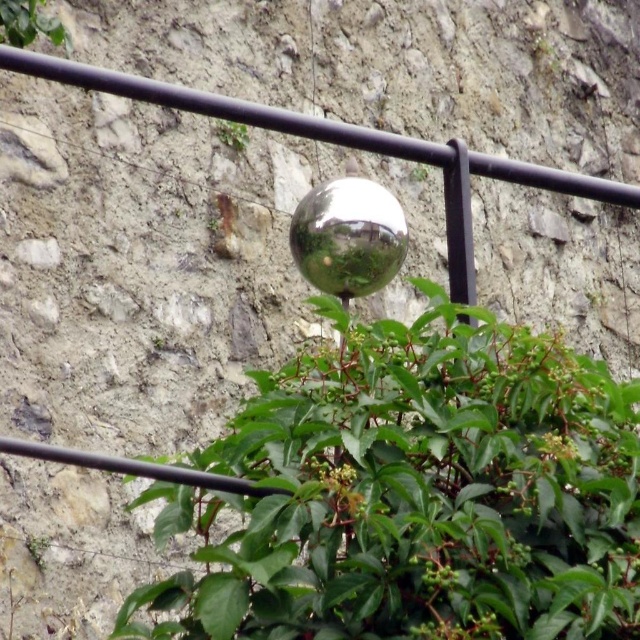
You are a gardener who wants to water both the green leafy bush at center and the green leafy plant at upper left. Which one should you water first if you want to start from the lower part of the scene?

You should water the green leafy bush at center first because it is located below the green leafy plant at upper left, so starting from the lower part makes sense.